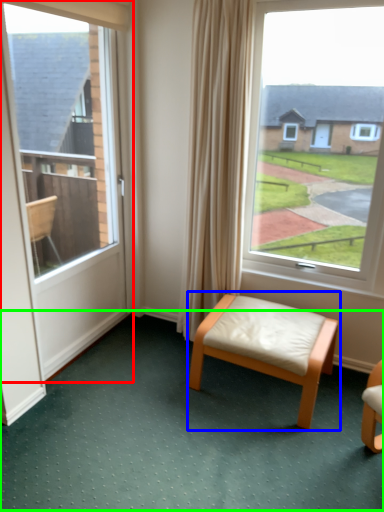
Question: Which object is positioned closest to door (highlighted by a red box)? Select from stool (highlighted by a blue box) and golf course (highlighted by a green box).

Choices:
 (A) stool
 (B) golf course

Answer: (B)